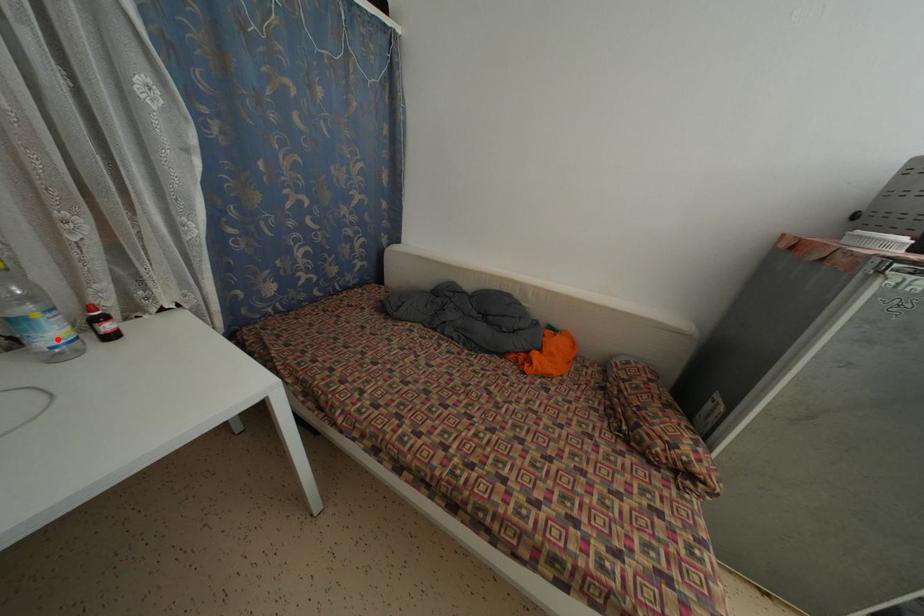
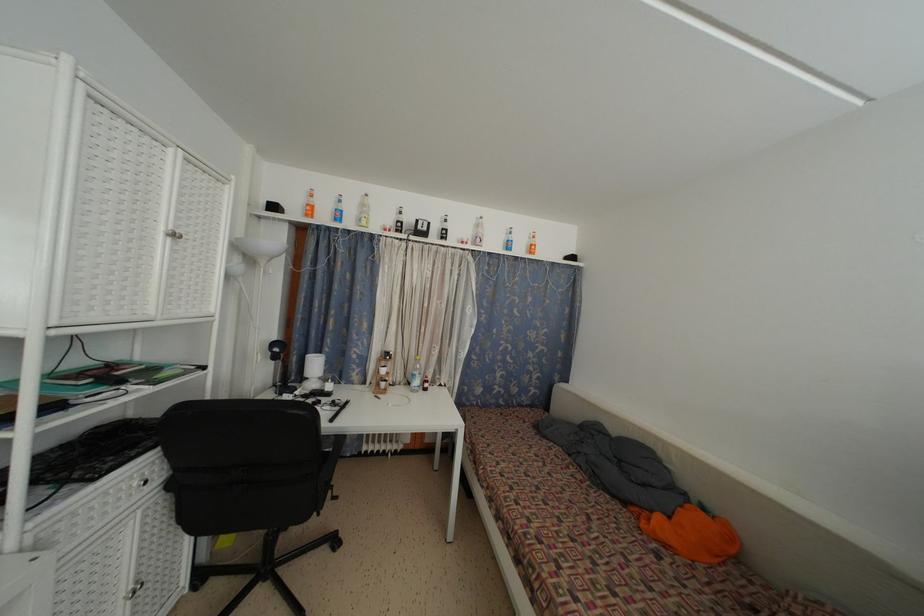
In the second image, find the point that corresponds to the highlighted location in the first image.

(420, 387)